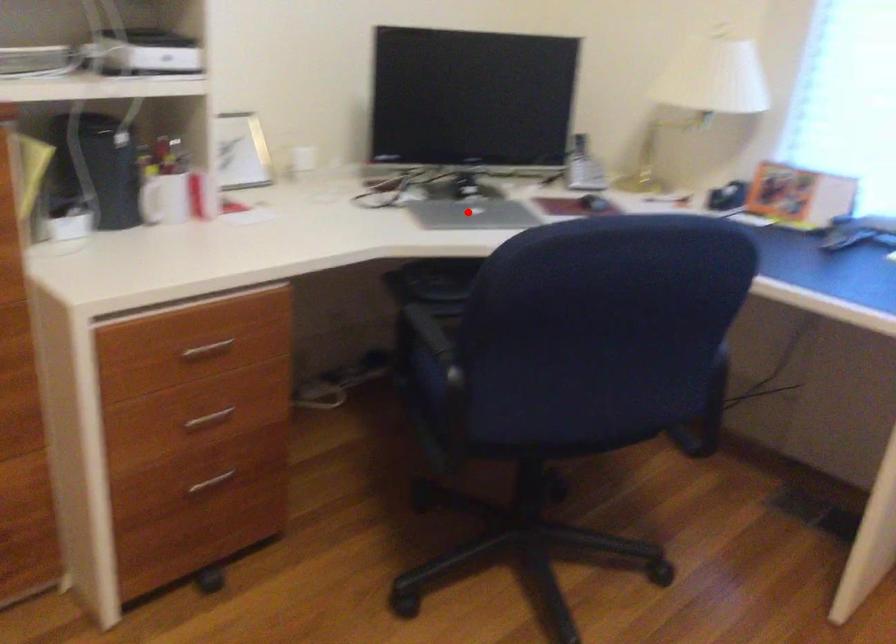
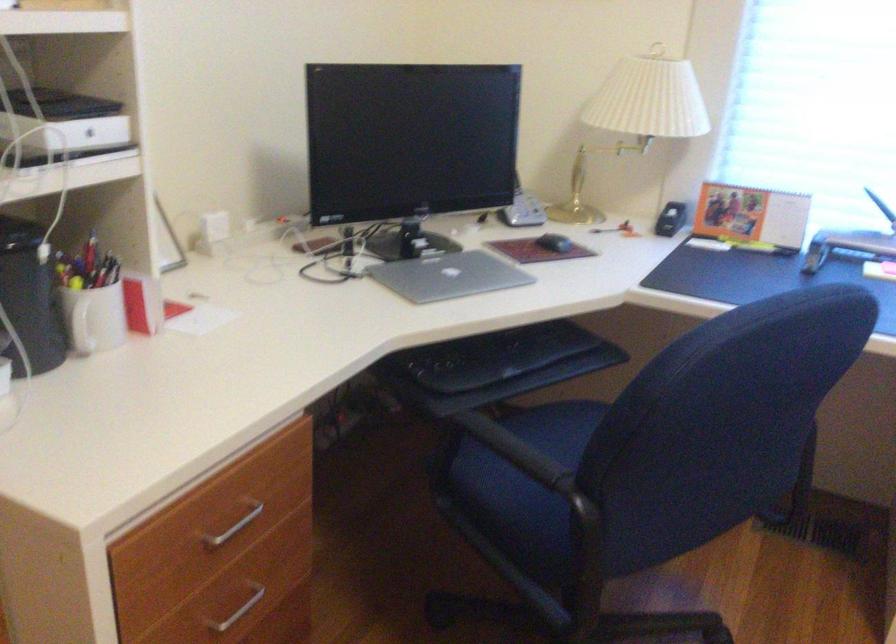
Question: I am providing you with two images of the same scene from different viewpoints. Image1 has a red point marked. In image2, the corresponding 3D location appears at what relative position? Reply with the corresponding letter.

Choices:
 (A) Closer
 (B) Farther

Answer: (A)